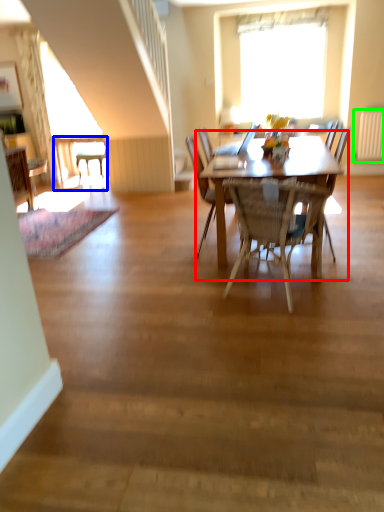
Question: Based on their relative distances, which object is farther from kitchen & dining room table (highlighted by a red box)? Choose from desk (highlighted by a blue box) and radiator (highlighted by a green box).

Choices:
 (A) desk
 (B) radiator

Answer: (A)